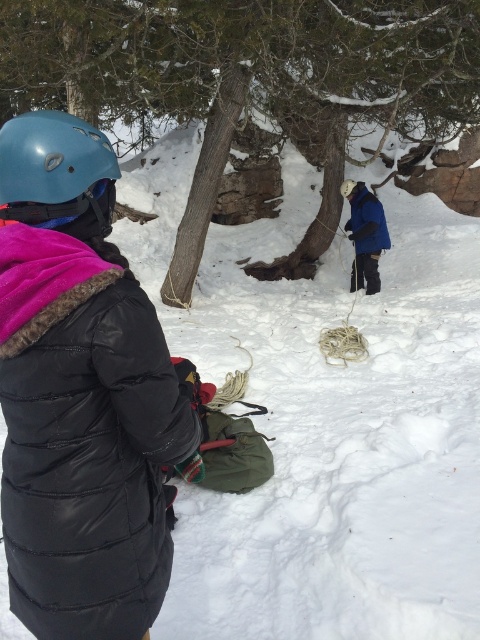
Question: Which point is closer to the camera taking this photo?

Choices:
 (A) (99, 172)
 (B) (7, 205)
 (C) (376, 288)

Answer: (B)

Question: Is blue fleece jacket at center bigger than blue matte helmet at upper left?

Choices:
 (A) yes
 (B) no

Answer: (A)

Question: Which object appears farthest from the camera in this image?

Choices:
 (A) blue matte helmet at upper left
 (B) blue fleece jacket at center
 (C) matte blue helmet at upper left
 (D) black puffy jacket at left

Answer: (B)

Question: Can you confirm if matte blue helmet at upper left is bigger than blue matte helmet at upper left?

Choices:
 (A) yes
 (B) no

Answer: (A)

Question: Is blue fleece jacket at center below blue matte helmet at upper left?

Choices:
 (A) yes
 (B) no

Answer: (B)

Question: Among these points, which one is nearest to the camera?

Choices:
 (A) (75, 193)
 (B) (9, 401)
 (C) (20, 204)
 (D) (375, 212)

Answer: (A)